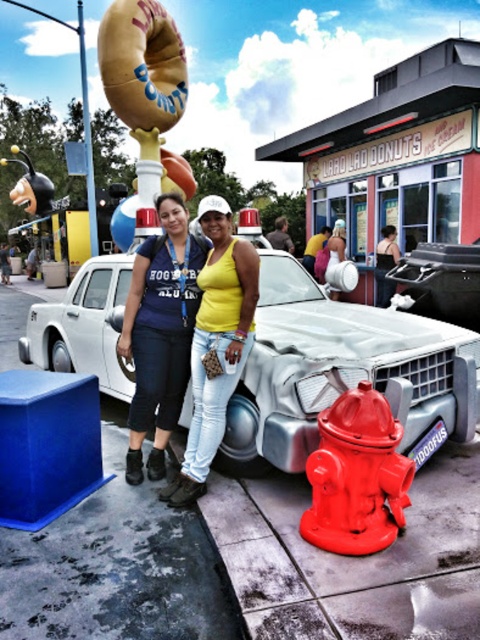
Does shiny red fire hydrant at lower right come behind smooth leather jacket at center?

No, it is in front of smooth leather jacket at center.

Who is taller, shiny red fire hydrant at lower right or smooth leather jacket at center?

Standing taller between the two is shiny red fire hydrant at lower right.

Which is in front, point (369, 474) or point (284, 225)?

Point (369, 474)

Identify the location of shiny red fire hydrant at lower right. The image size is (480, 640). (357, 476).

Which is behind, point (312, 257) or point (288, 243)?

The point (312, 257) is behind.

Is yellow fabric shirt at center further to camera compared to smooth leather jacket at center?

No.

Is point (310, 269) more distant than point (283, 228)?

That is True.

At what (x,y) coordinates should I click in order to perform the action: click on yellow fabric shirt at center. Please return your answer as a coordinate pair (x, y). The image size is (480, 640). Looking at the image, I should click on (314, 248).

Which is below, metallic silver car at center or shiny red fire hydrant at lower right?

shiny red fire hydrant at lower right

Can you confirm if metallic silver car at center is positioned to the left of shiny red fire hydrant at lower right?

Incorrect, metallic silver car at center is not on the left side of shiny red fire hydrant at lower right.

This screenshot has width=480, height=640. What are the coordinates of `metallic silver car at center` in the screenshot? It's located at (343, 372).

Locate an element on the screen. This screenshot has width=480, height=640. metallic silver car at center is located at coordinates (343, 372).